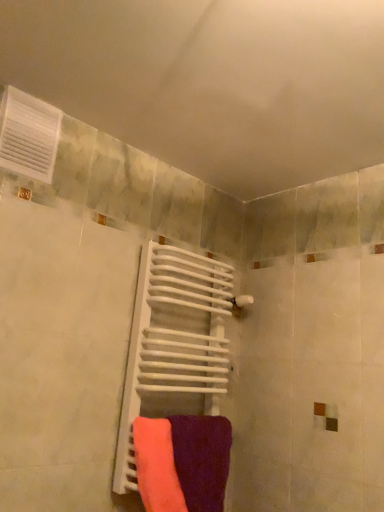
Question: Considering the relative positions of purple matte towel at center, the 2th towel when ordered from left to right, and neon pink fabric at center, which ranks as the 1th towel in left-to-right order, in the image provided, is purple matte towel at center, the 2th towel when ordered from left to right, to the left of neon pink fabric at center, which ranks as the 1th towel in left-to-right order, from the viewer's perspective?

Choices:
 (A) yes
 (B) no

Answer: (B)

Question: Are purple matte towel at center, the first towel when ordered from right to left, and neon pink fabric at center, which ranks as the 1th towel in left-to-right order, far apart?

Choices:
 (A) yes
 (B) no

Answer: (B)

Question: Can you confirm if purple matte towel at center, the first towel when ordered from right to left, is thinner than neon pink fabric at center, which ranks as the 1th towel in left-to-right order?

Choices:
 (A) no
 (B) yes

Answer: (A)

Question: Considering the relative positions of purple matte towel at center, the 2th towel when ordered from left to right, and neon pink fabric at center, which ranks as the 2th towel in right-to-left order, in the image provided, is purple matte towel at center, the 2th towel when ordered from left to right, behind neon pink fabric at center, which ranks as the 2th towel in right-to-left order,?

Choices:
 (A) yes
 (B) no

Answer: (A)

Question: Could you tell me if purple matte towel at center, the 2th towel when ordered from left to right, is facing neon pink fabric at center, which ranks as the 2th towel in right-to-left order?

Choices:
 (A) no
 (B) yes

Answer: (A)

Question: Considering the positions of white matte radiator at center and white plastic vent at upper left in the image, is white matte radiator at center taller or shorter than white plastic vent at upper left?

Choices:
 (A) tall
 (B) short

Answer: (A)

Question: In terms of width, does white matte radiator at center look wider or thinner when compared to white plastic vent at upper left?

Choices:
 (A) wide
 (B) thin

Answer: (A)

Question: From the image's perspective, relative to white plastic vent at upper left, is white matte radiator at center above or below?

Choices:
 (A) below
 (B) above

Answer: (A)

Question: Considering the positions of white matte radiator at center and white plastic vent at upper left in the image, is white matte radiator at center bigger or smaller than white plastic vent at upper left?

Choices:
 (A) big
 (B) small

Answer: (A)

Question: Looking at their shapes, would you say white matte radiator at center is wider or thinner than neon pink fabric at center, which ranks as the 2th towel in right-to-left order?

Choices:
 (A) wide
 (B) thin

Answer: (A)

Question: Visually, is white matte radiator at center positioned to the left or to the right of neon pink fabric at center, which ranks as the 1th towel in left-to-right order?

Choices:
 (A) left
 (B) right

Answer: (B)

Question: Based on their sizes in the image, would you say white matte radiator at center is bigger or smaller than neon pink fabric at center, which ranks as the 2th towel in right-to-left order?

Choices:
 (A) big
 (B) small

Answer: (A)

Question: Does point [195, 401] appear closer or farther from the camera than point [153, 449]?

Choices:
 (A) farther
 (B) closer

Answer: (A)

Question: In the image, is white plastic vent at upper left positioned in front of or behind purple matte towel at center, the first towel when ordered from right to left?

Choices:
 (A) front
 (B) behind

Answer: (A)

Question: Is white plastic vent at upper left bigger or smaller than purple matte towel at center, the first towel when ordered from right to left?

Choices:
 (A) big
 (B) small

Answer: (B)